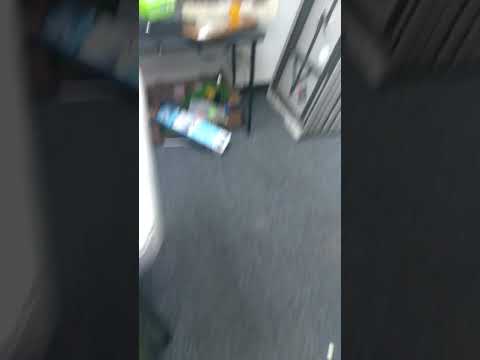
This screenshot has height=360, width=480. Identify the location of table top. (169, 38).